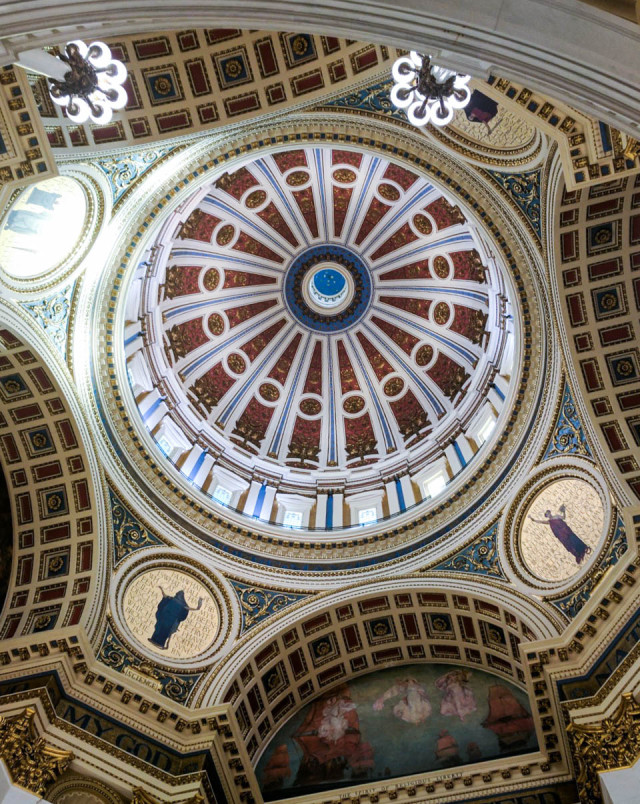
You are a GUI agent. You are given a task and a screenshot of the screen. Output one action in this format:
    pyautogui.click(x=<x>, y=<y>)
    Task: Click on the doorways
    The width and height of the screenshot is (640, 804).
    Given the screenshot: What is the action you would take?
    pyautogui.click(x=164, y=446), pyautogui.click(x=225, y=498), pyautogui.click(x=299, y=517), pyautogui.click(x=372, y=518), pyautogui.click(x=441, y=482), pyautogui.click(x=486, y=437), pyautogui.click(x=507, y=366), pyautogui.click(x=124, y=318), pyautogui.click(x=132, y=368)